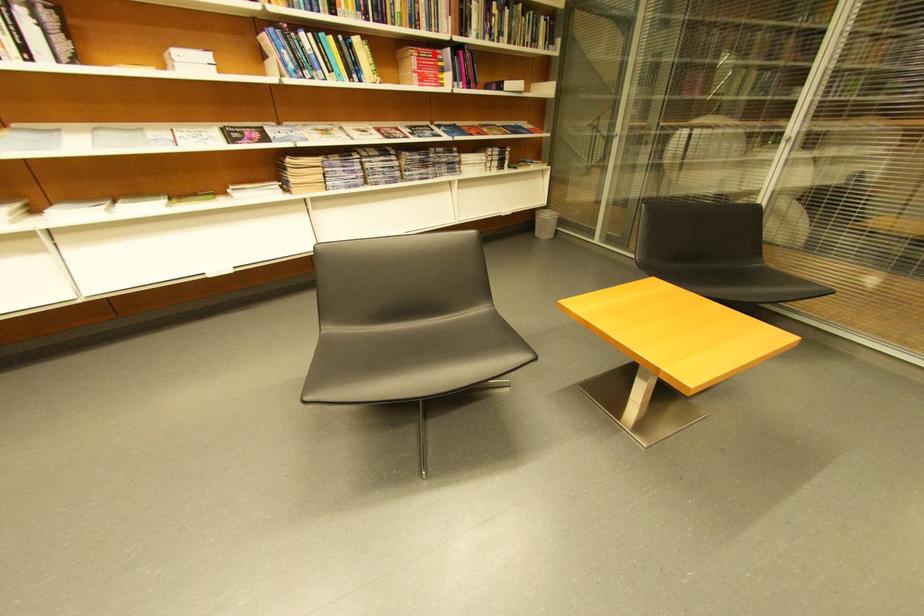
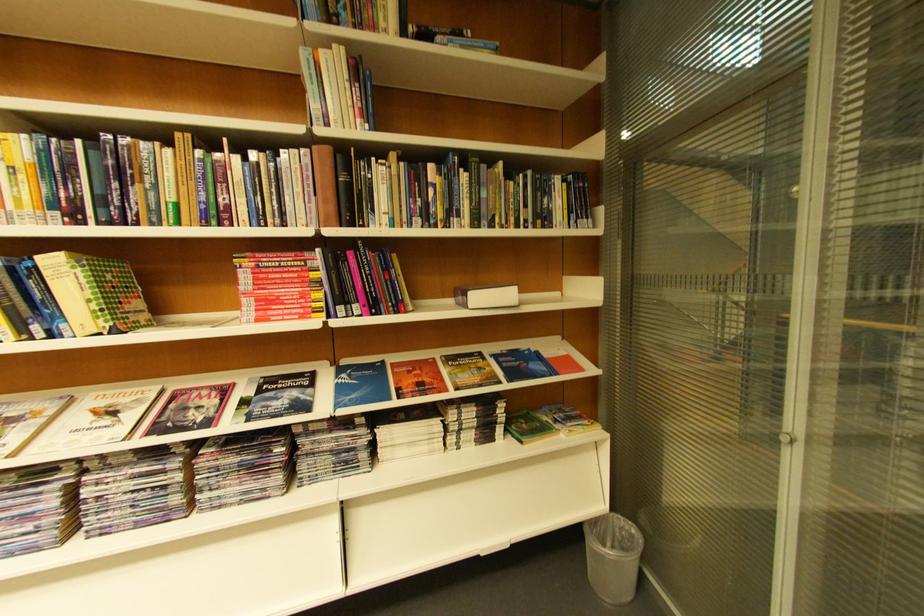
Find the pixel in the second image that matches the highlighted location in the first image.

(281, 262)